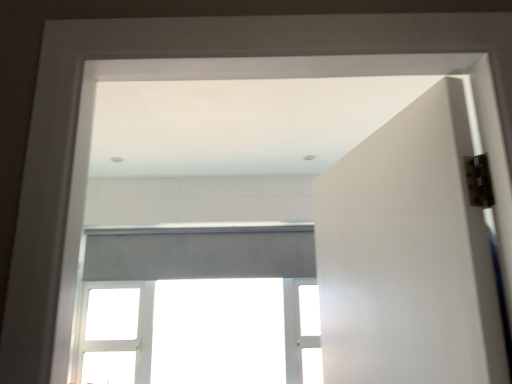
Question: Based on their sizes in the image, would you say white matte window at center is bigger or smaller than white matte door at right?

Choices:
 (A) big
 (B) small

Answer: (A)

Question: Relative to white matte door at right, is white matte window at center in front or behind?

Choices:
 (A) front
 (B) behind

Answer: (B)

Question: From the image's perspective, is white matte window at center positioned above or below white matte door at right?

Choices:
 (A) below
 (B) above

Answer: (A)

Question: Is white matte door at right wider or thinner than white matte window at center?

Choices:
 (A) thin
 (B) wide

Answer: (B)

Question: From a real-world perspective, is white matte door at right physically located above or below white matte window at center?

Choices:
 (A) below
 (B) above

Answer: (B)

Question: Considering their positions, is white matte door at right located in front of or behind white matte window at center?

Choices:
 (A) behind
 (B) front

Answer: (B)

Question: Is white matte door at right taller or shorter than white matte window at center?

Choices:
 (A) short
 (B) tall

Answer: (A)